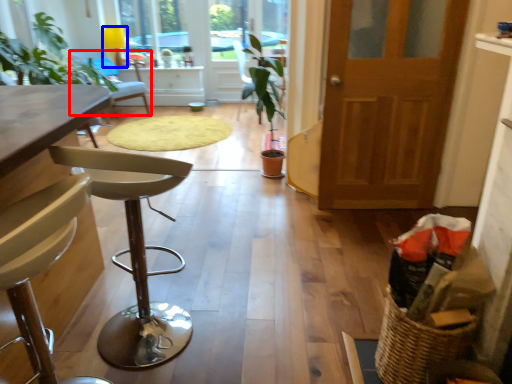
Question: Which object is closer to the camera taking this photo, chair (highlighted by a red box) or lamp (highlighted by a blue box)?

Choices:
 (A) chair
 (B) lamp

Answer: (A)